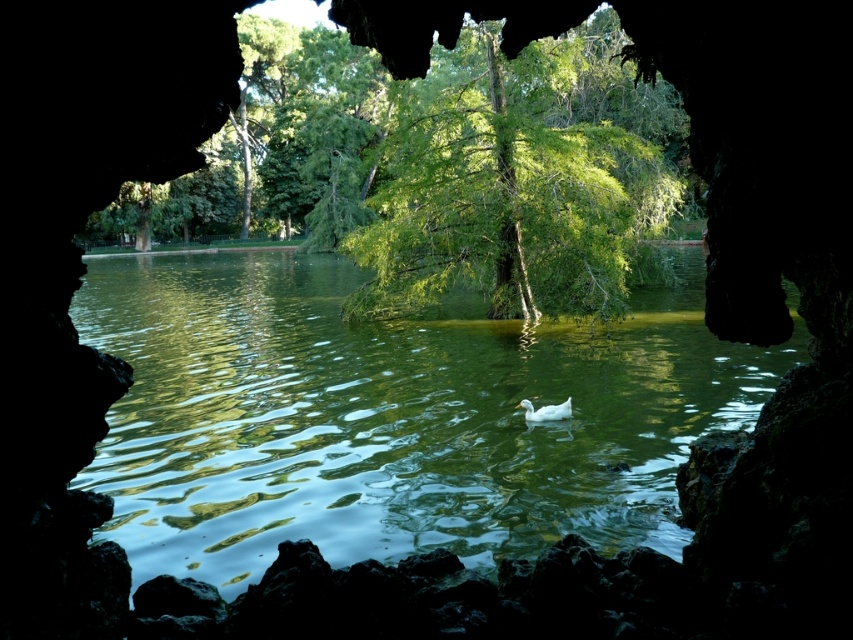
Question: Can you confirm if green smooth water at center is positioned to the right of green leafy tree at center?

Choices:
 (A) no
 (B) yes

Answer: (A)

Question: Which point appears closest to the camera in this image?

Choices:
 (A) (492, 83)
 (B) (286, 524)

Answer: (B)

Question: Which object is closer to the camera taking this photo?

Choices:
 (A) green leafy tree at center
 (B) green smooth water at center

Answer: (B)

Question: Can you confirm if green smooth water at center is bigger than green leafy tree at center?

Choices:
 (A) no
 (B) yes

Answer: (B)

Question: In this image, where is green smooth water at center located relative to green leafy tree at center?

Choices:
 (A) right
 (B) left

Answer: (B)